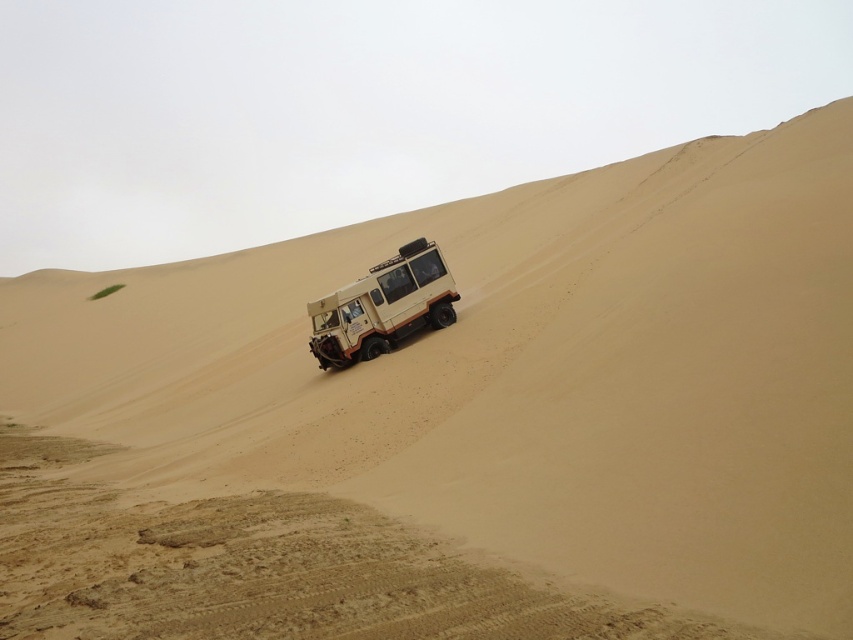
You are a driver navigating a desert terrain and see the beige matte jeep at center ahead. There is a brown sandy dirt track at lower center. Which direction should you steer to stay on the track?

The brown sandy dirt track at lower center is positioned under the beige matte jeep at center, so you should steer downward to follow the track below the beige matte jeep at center.

You are a driver of the beige matte jeep at center and you want to stay on the brown sandy dirt track at lower center. Can you drive through the middle of the track without going off the sides?

The brown sandy dirt track at lower center is wider than the beige matte jeep at center, so yes, you can drive through the middle of the track without going off the sides.